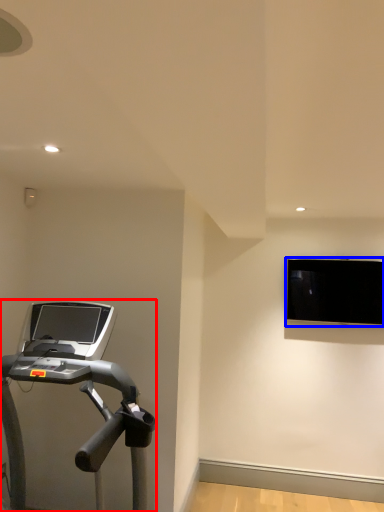
Question: Which of the following is the farthest to the observer, treadmill (highlighted by a red box) or computer monitor (highlighted by a blue box)?

Choices:
 (A) treadmill
 (B) computer monitor

Answer: (B)